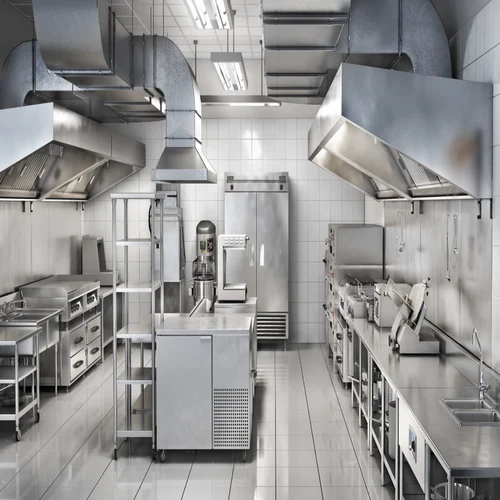
Where is `knobs`? The height and width of the screenshot is (500, 500). knobs is located at coordinates (72, 308), (78, 307), (88, 303), (94, 298).